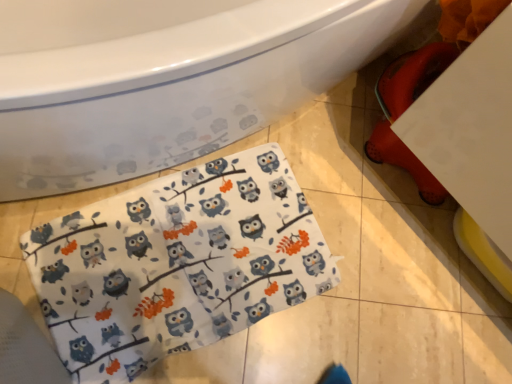
Question: Is white glossy bathtub at upper left in front of or behind white fabric with owl print at lower center in the image?

Choices:
 (A) front
 (B) behind

Answer: (A)

Question: Looking at their shapes, would you say white glossy bathtub at upper left is wider or thinner than white fabric with owl print at lower center?

Choices:
 (A) wide
 (B) thin

Answer: (A)

Question: Does point (229, 34) appear closer or farther from the camera than point (248, 296)?

Choices:
 (A) farther
 (B) closer

Answer: (B)

Question: Is white fabric with owl print at lower center taller or shorter than white glossy bathtub at upper left?

Choices:
 (A) short
 (B) tall

Answer: (A)

Question: Would you say white fabric with owl print at lower center is to the left or to the right of white glossy bathtub at upper left in the picture?

Choices:
 (A) left
 (B) right

Answer: (B)

Question: From a real-world perspective, is white fabric with owl print at lower center positioned above or below white glossy bathtub at upper left?

Choices:
 (A) below
 (B) above

Answer: (A)

Question: Is white fabric with owl print at lower center situated inside white glossy bathtub at upper left or outside?

Choices:
 (A) inside
 (B) outside

Answer: (B)